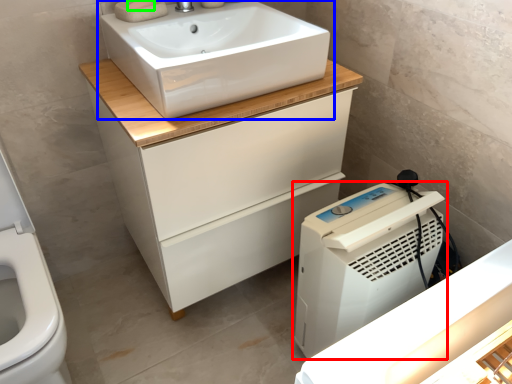
Question: Which object is positioned closest to home appliance (highlighted by a red box)? Select from sink (highlighted by a blue box) and soap (highlighted by a green box).

Choices:
 (A) sink
 (B) soap

Answer: (A)